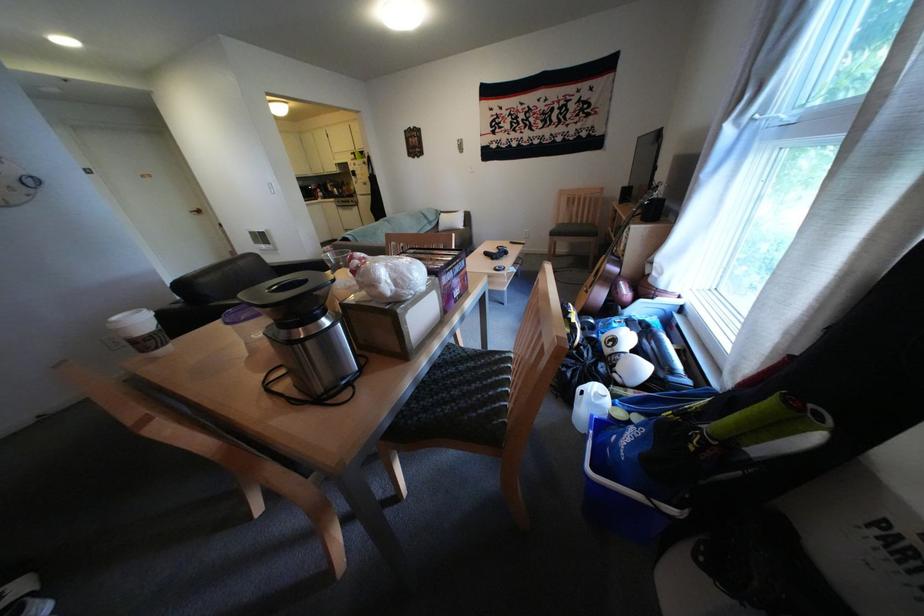
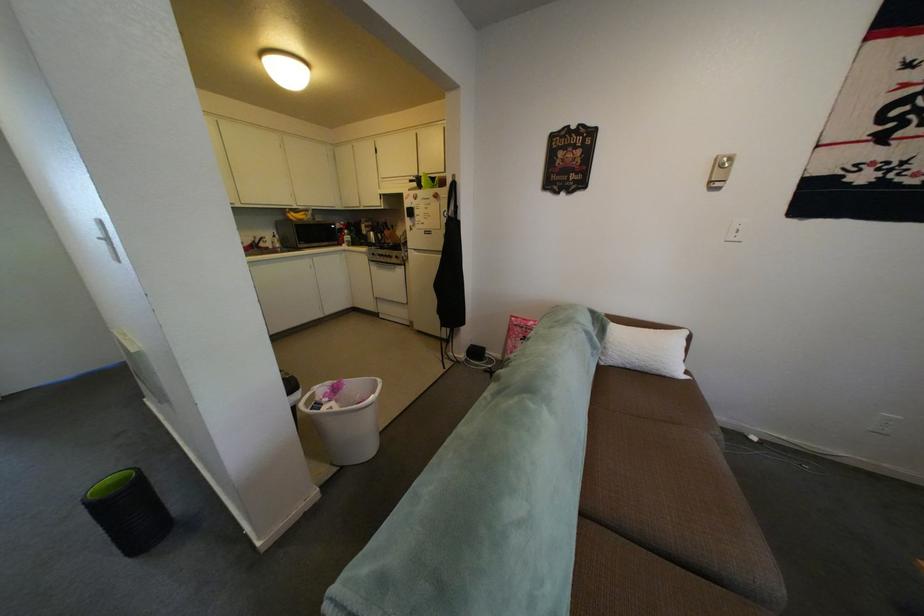
In a continuous first-person perspective shot, in which direction is the camera moving?

The cameraman walked toward left, forward.